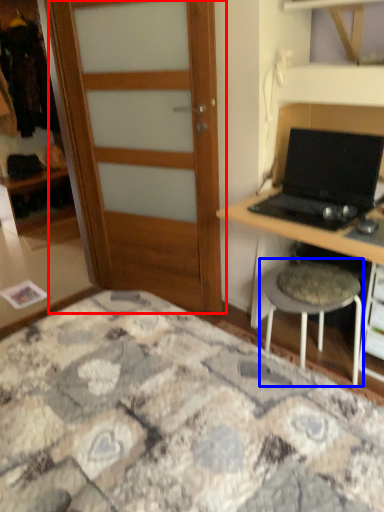
Question: Which point is further to the camera, door (highlighted by a red box) or stool (highlighted by a blue box)?

Choices:
 (A) door
 (B) stool

Answer: (A)